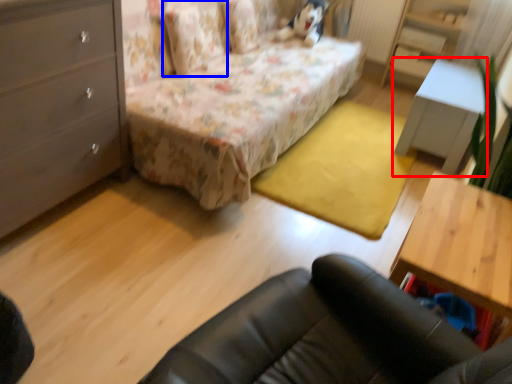
Question: Which point is closer to the camera, table (highlighted by a red box) or pillow (highlighted by a blue box)?

Choices:
 (A) table
 (B) pillow

Answer: (B)